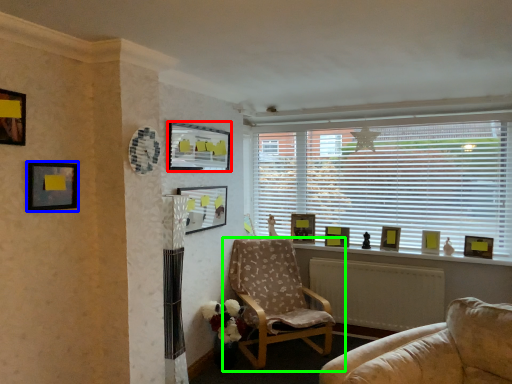
Question: Which object is the farthest from picture frame (highlighted by a red box)? Choose among these: picture frame (highlighted by a blue box) or chair (highlighted by a green box).

Choices:
 (A) picture frame
 (B) chair

Answer: (B)